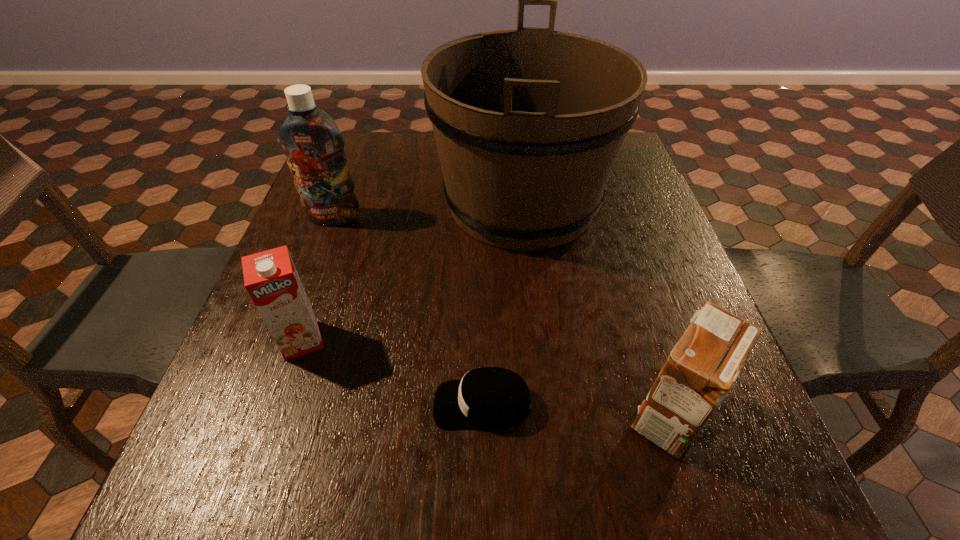
You are a GUI agent. You are given a task and a screenshot of the screen. Output one action in this format:
    pyautogui.click(x=<x>, y=<y>)
    Task: Click on the object that is positioned at the far right corner
    
    Given the screenshot: What is the action you would take?
    pyautogui.click(x=528, y=123)

Where is `free space at the far edge of the desktop`? free space at the far edge of the desktop is located at coordinates (394, 133).

Identify the location of vacant space at the near edge of the desktop. (395, 519).

Image resolution: width=960 pixels, height=540 pixels. Identify the location of free region at the left edge of the desktop. (343, 261).

You are a GUI agent. You are given a task and a screenshot of the screen. Output one action in this format:
    pyautogui.click(x=<x>, y=<y>)
    Task: Click on the vacant area at the right edge
    
    Given the screenshot: What is the action you would take?
    pyautogui.click(x=663, y=316)

You are a GUI agent. You are given a task and a screenshot of the screen. Output one action in this format:
    pyautogui.click(x=<x>, y=<y>)
    Task: Click on the vacant space at the near right corner of the desktop
    Image resolution: width=960 pixels, height=540 pixels.
    Given the screenshot: What is the action you would take?
    pyautogui.click(x=699, y=463)

Locate an element on the screen. free spot between the tallest object and the shortest object is located at coordinates (502, 304).

This screenshot has height=540, width=960. What are the coordinates of `vacant area that lies between the shortest object and the nearer carton` in the screenshot? It's located at (576, 410).

Where is `vacant space that is in between the tallest object and the nearer carton`? Image resolution: width=960 pixels, height=540 pixels. vacant space that is in between the tallest object and the nearer carton is located at coordinates (595, 310).

This screenshot has height=540, width=960. Identify the location of vacant space that's between the cap and the bucket. (502, 304).